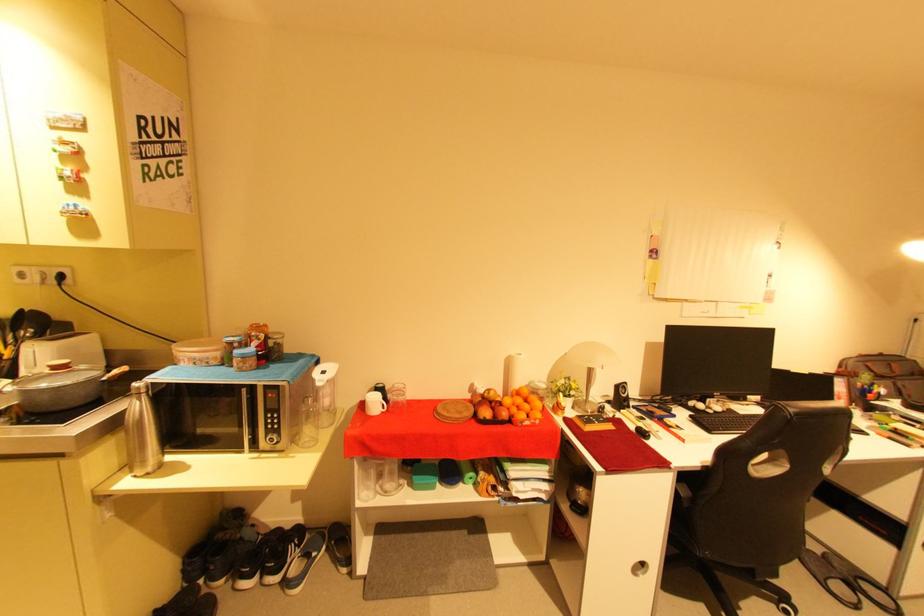
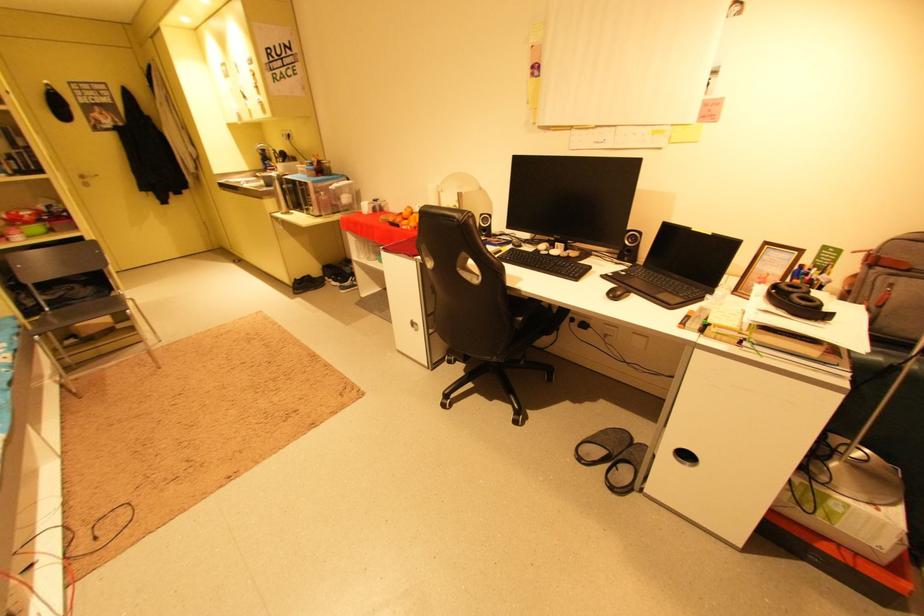
Question: I am providing you with two images of the same scene from different viewpoints. After the viewpoint changes to image2, which objects are now occluded?

Choices:
 (A) small black speaker
 (B) red heater button
 (C) backpack handle
 (D) computer mouse

Answer: (D)